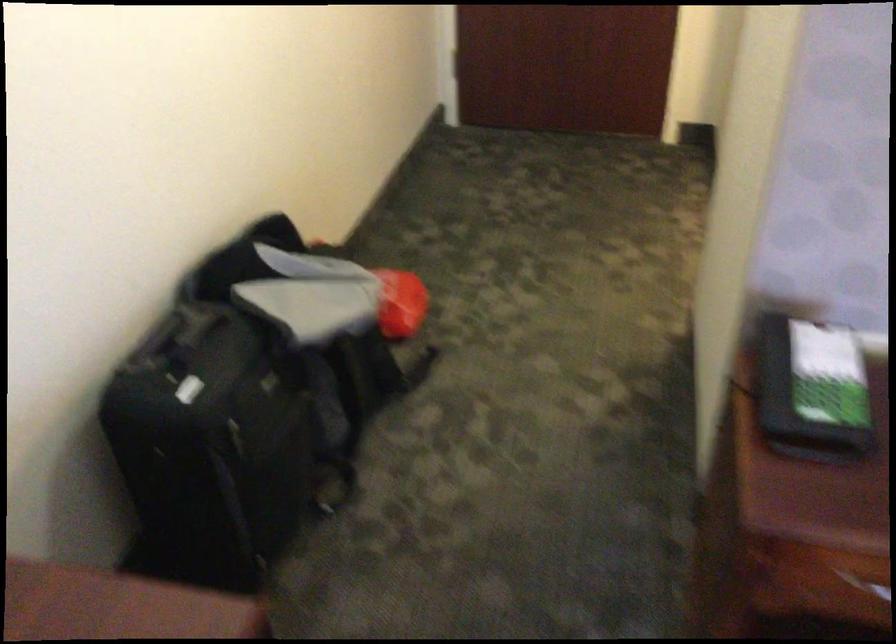
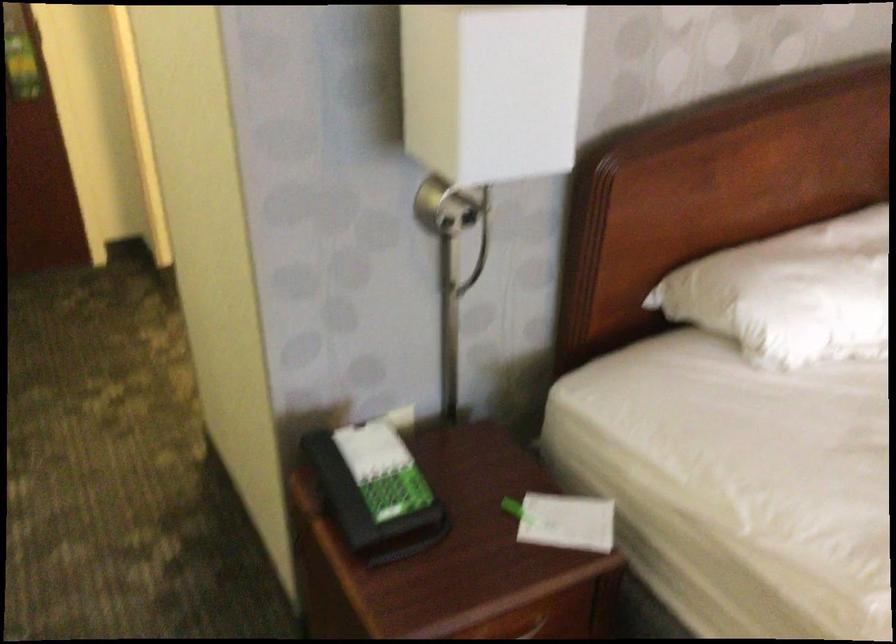
Question: The first image is from the beginning of the video and the second image is from the end. How did the camera likely rotate when shooting the video?

Choices:
 (A) Left
 (B) Right
 (C) Up
 (D) Down

Answer: (B)